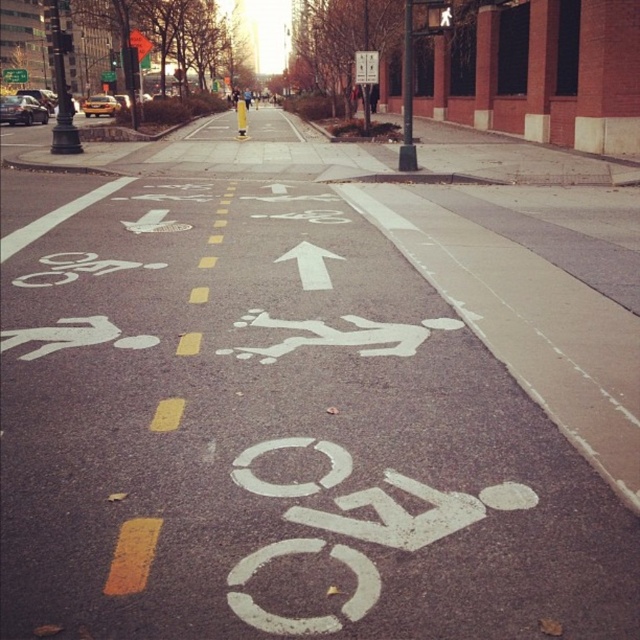
Question: Does white painted bike lane at center have a smaller size compared to yellow plastic traffic sign at upper center?

Choices:
 (A) no
 (B) yes

Answer: (A)

Question: Can you confirm if metallic rectangular sign at upper center is thinner than yellow plastic traffic sign at upper center?

Choices:
 (A) yes
 (B) no

Answer: (A)

Question: Which point is closer to the camera?

Choices:
 (A) (618, 524)
 (B) (17, 67)
 (C) (368, 52)

Answer: (A)

Question: Among these objects, which one is farthest from the camera?

Choices:
 (A) metallic rectangular sign at upper center
 (B) yellow plastic traffic sign at upper center
 (C) white painted bike lane at center

Answer: (B)

Question: Which of these objects is positioned farthest from the metallic rectangular sign at upper center?

Choices:
 (A) white painted bike lane at center
 (B) yellow plastic traffic sign at upper center

Answer: (B)

Question: Is white painted bike lane at center to the left of yellow plastic traffic sign at upper center from the viewer's perspective?

Choices:
 (A) yes
 (B) no

Answer: (B)